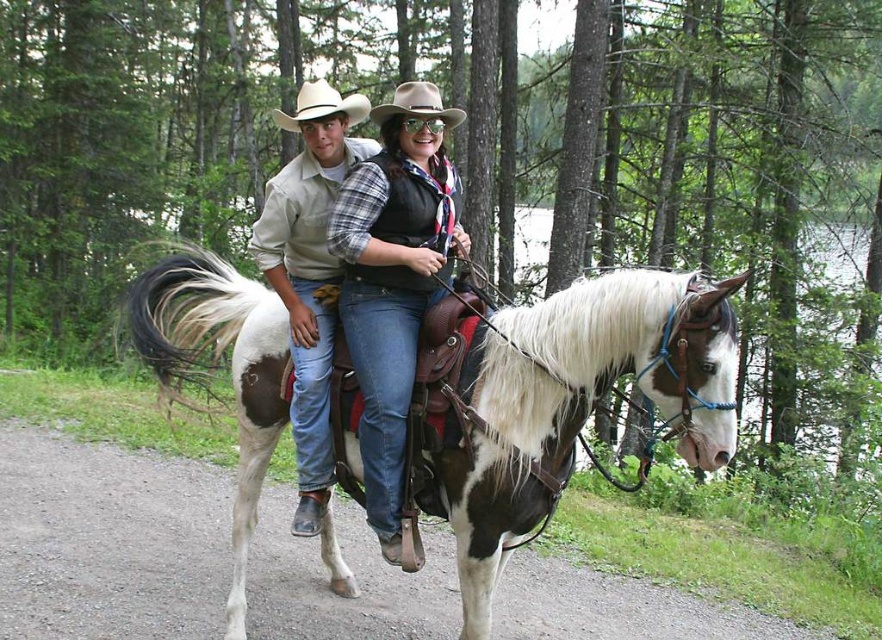
Question: Does matte black vest at center appear on the left side of light brown felt cowboy hat at upper center?

Choices:
 (A) yes
 (B) no

Answer: (B)

Question: In this image, where is painted leather saddle at center located relative to light brown felt cowboy hat at upper center?

Choices:
 (A) left
 (B) right

Answer: (B)

Question: Which object is positioned farthest from the beige felt cowboy hat at center?

Choices:
 (A) light brown felt cowboy hat at upper center
 (B) matte black vest at center

Answer: (B)

Question: Which object appears farthest from the camera in this image?

Choices:
 (A) light brown felt cowboy hat at upper center
 (B) beige felt cowboy hat at center

Answer: (A)

Question: Is painted leather saddle at center positioned in front of matte black vest at center?

Choices:
 (A) yes
 (B) no

Answer: (B)

Question: Which of the following is the farthest from the observer?

Choices:
 (A) (327, 403)
 (B) (267, 369)

Answer: (B)